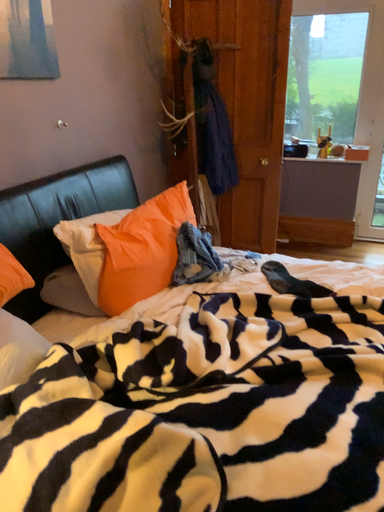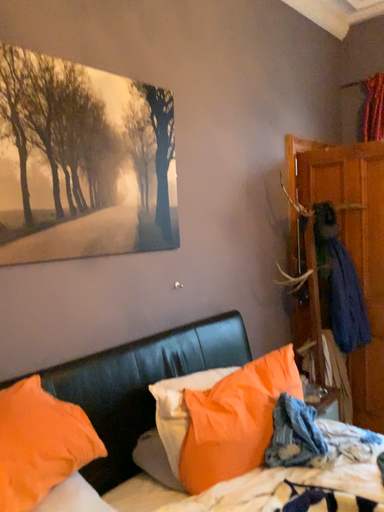
Question: Which way did the camera rotate in the video?

Choices:
 (A) rotated upward
 (B) rotated downward

Answer: (A)